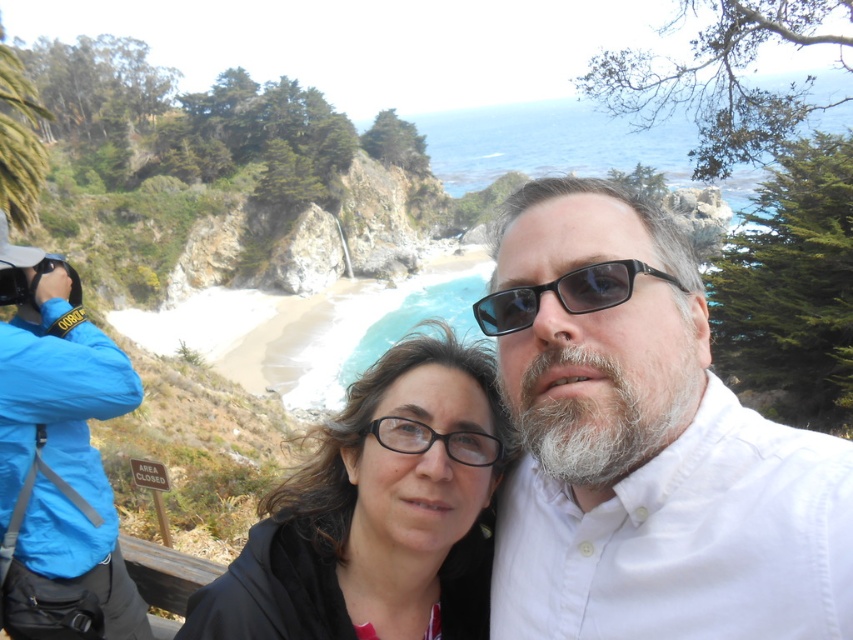
Question: Which of the following is the closest to the observer?

Choices:
 (A) click(618, 419)
 (B) click(648, 275)

Answer: (A)

Question: Which is farther from the white fuzzy beard at center?

Choices:
 (A) black plastic sunglasses at center
 (B) blue fabric jacket at left

Answer: (B)

Question: Is blue fabric jacket at left bigger than black plastic sunglasses at center?

Choices:
 (A) yes
 (B) no

Answer: (A)

Question: Is white cotton shirt at center positioned before blue fabric jacket at left?

Choices:
 (A) yes
 (B) no

Answer: (A)

Question: Does blue fabric jacket at left have a smaller size compared to black plastic sunglasses at center?

Choices:
 (A) yes
 (B) no

Answer: (B)

Question: Estimate the real-world distances between objects in this image. Which object is farther from the black plastic sunglasses at center?

Choices:
 (A) blue fabric jacket at left
 (B) white fuzzy beard at center

Answer: (A)